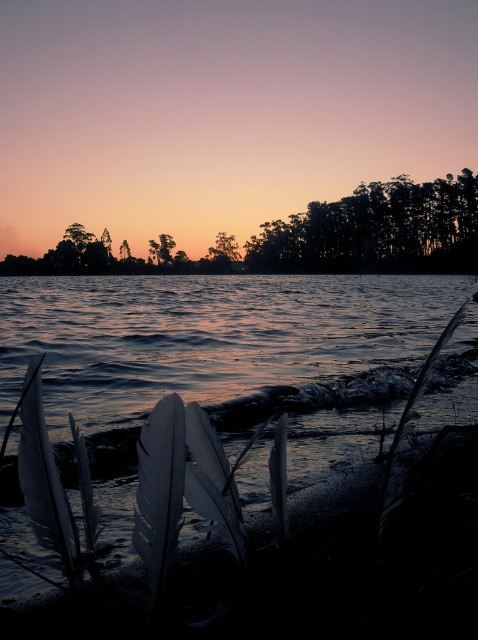
Is silhouette trees at upper center below dark green leafy trees at upper center?

Actually, silhouette trees at upper center is above dark green leafy trees at upper center.

Which is behind, point (126, 259) or point (453, 188)?

Point (126, 259)

Does point (22, 256) come behind point (345, 237)?

Yes, point (22, 256) is behind point (345, 237).

Image resolution: width=478 pixels, height=640 pixels. I want to click on silhouette trees at upper center, so click(377, 230).

Is white matte surfboard at center taller than green leafy tree at center?

In fact, white matte surfboard at center may be shorter than green leafy tree at center.

Does white matte surfboard at center have a greater width compared to green leafy tree at center?

No.

Based on the photo, who is more distant from viewer, (138, 538) or (150, 243)?

Positioned behind is point (150, 243).

Identify the location of white matte surfboard at center. (160, 492).

Which is more to the left, white matte surfboard at center or silhouette tree at center?

Positioned to the left is silhouette tree at center.

Is white matte surfboard at center wider than silhouette tree at center?

Incorrect, white matte surfboard at center's width does not surpass silhouette tree at center's.

The width and height of the screenshot is (478, 640). Identify the location of white matte surfboard at center. (160, 492).